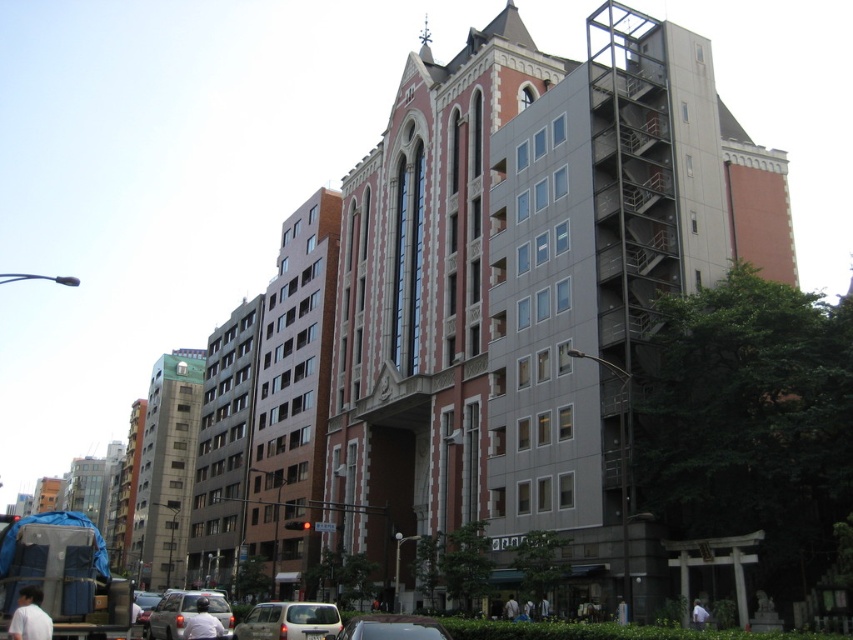
You are a delivery person trying to park your vehicle in a narrow alley between the two cars. The alley is only 1.8 meters wide. Can both the white matte car at center and the matte gray car at lower left fit side by side in the alley without overlapping?

The white matte car at center is taller than the matte gray car at lower left, but the question is about width, not height. Since the alley is 1.8 meters wide and we don not have information about the cars width, we cannot determine if they can fit side by side.

You are a delivery person who needs to park your vehicle in this area. You have a white matte car at center and a matte gray car at lower left. Which car requires more space to park?

The white matte car at center requires more space to park because it has a larger size compared to the matte gray car at lower left.

You are an architect reviewing a city map and see the point labeled as point (628,257). What does this point indicate in the urban street scene?

The point labeled as point (628,257) indicates metallic gray scaffolding at right.